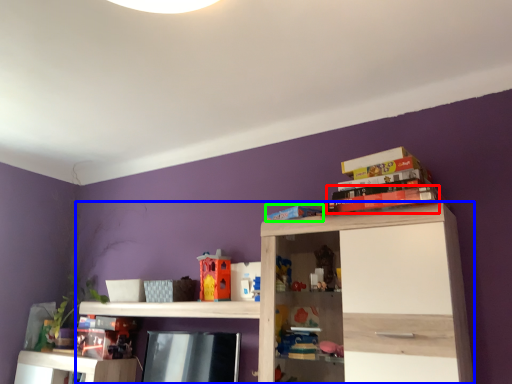
Question: Estimate the real-world distances between objects in this image. Which object is closer to book (highlighted by a red box), shelf (highlighted by a blue box) or book (highlighted by a green box)?

Choices:
 (A) shelf
 (B) book

Answer: (B)